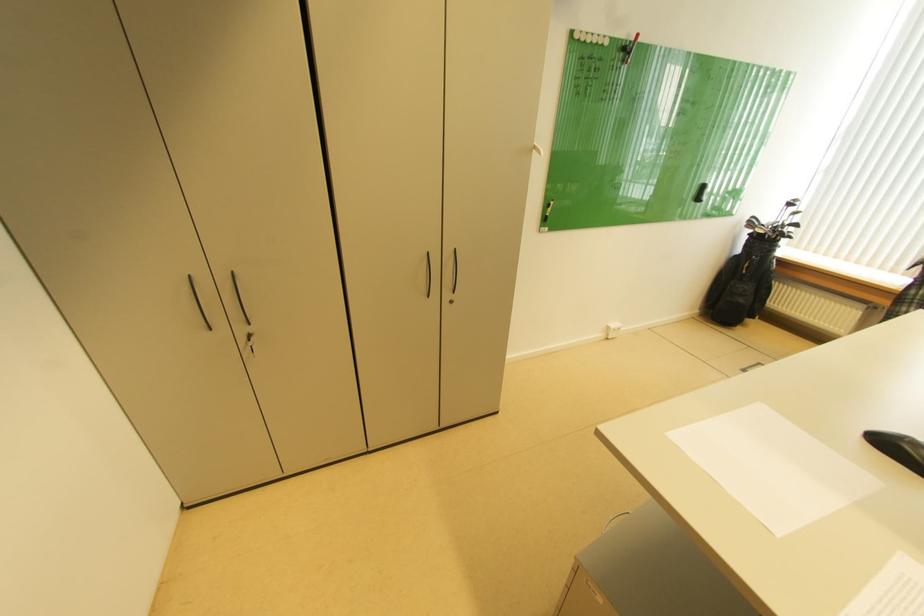
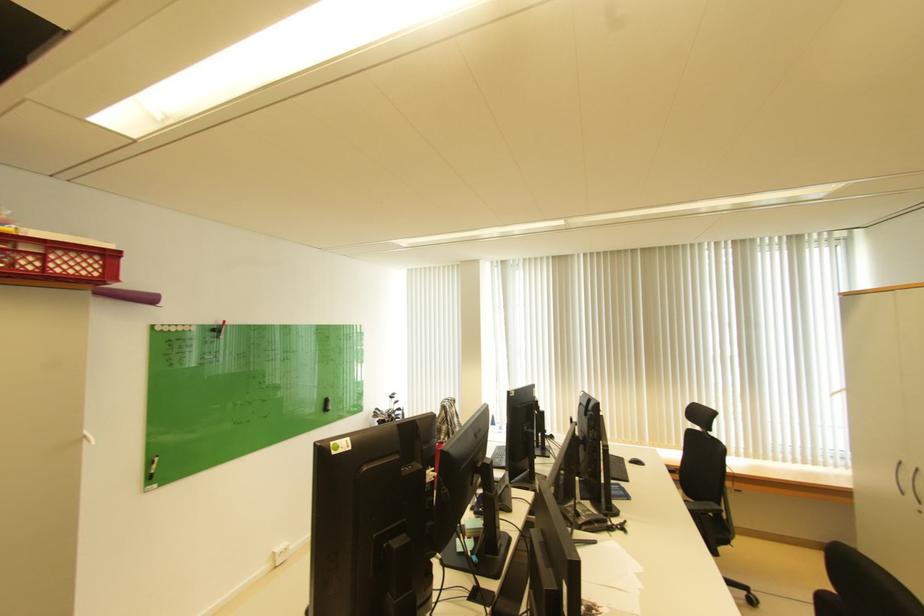
The images are taken continuously from a first-person perspective. In which direction is your viewpoint rotating?

The camera's rotation is toward right-up.